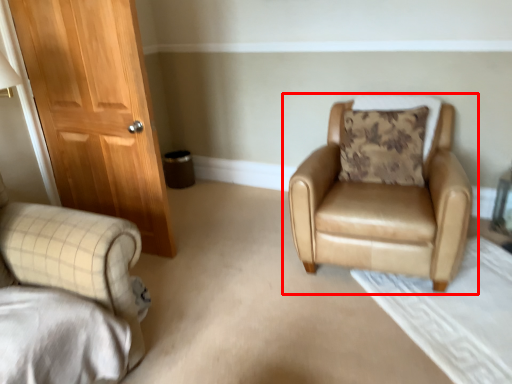
Question: From the image, what is the correct spatial relationship of chair (annotated by the red box) in relation to pillow?

Choices:
 (A) right
 (B) left

Answer: (B)